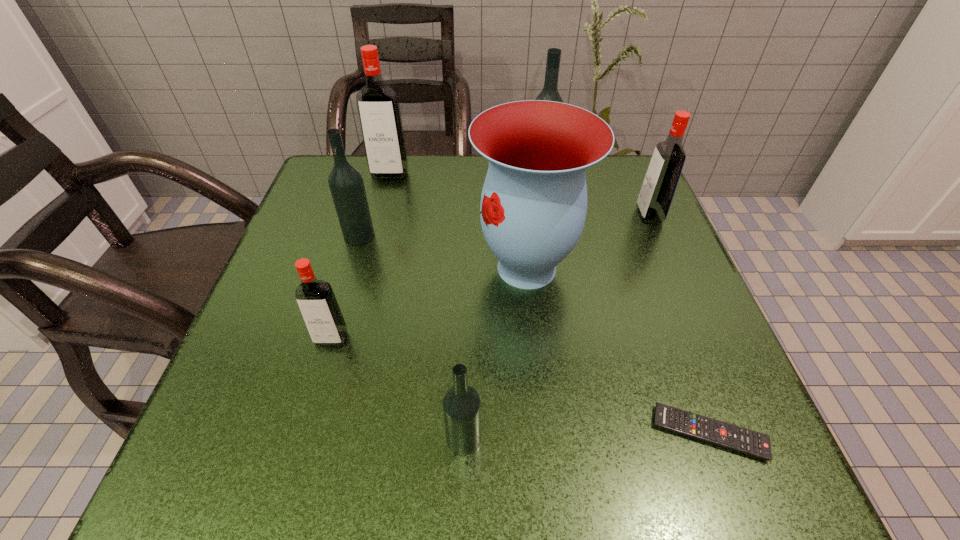
The image size is (960, 540). What are the coordinates of `the third vodka from right to left` in the screenshot? It's located at (461, 404).

Find the location of a particular element. the second black vodka from right to left is located at coordinates (461, 404).

This screenshot has height=540, width=960. Find the location of `remote control`. remote control is located at coordinates (732, 437).

This screenshot has width=960, height=540. Find the location of `blank area located on the right of the biggest black vodka`. blank area located on the right of the biggest black vodka is located at coordinates (625, 178).

At what (x,y) coordinates should I click in order to perform the action: click on vacant region located on the front and back of the biggest red vodka. Please return your answer as a coordinate pair (x, y). This screenshot has width=960, height=540. Looking at the image, I should click on (377, 222).

Find the location of a particular element. The image size is (960, 540). free space located 0.200m on the left of the vase is located at coordinates (371, 268).

The width and height of the screenshot is (960, 540). Find the location of `free spot located on the front and back of the rightmost vodka`. free spot located on the front and back of the rightmost vodka is located at coordinates (504, 215).

Image resolution: width=960 pixels, height=540 pixels. I want to click on vacant region located 0.380m on the front and back of the rightmost vodka, so tap(468, 215).

At what (x,y) coordinates should I click in order to perform the action: click on vacant area situated on the front and back of the rightmost vodka. Please return your answer as a coordinate pair (x, y). This screenshot has width=960, height=540. Looking at the image, I should click on (544, 215).

The image size is (960, 540). What are the coordinates of `free region located on the left of the second nearest black vodka` in the screenshot? It's located at click(x=302, y=235).